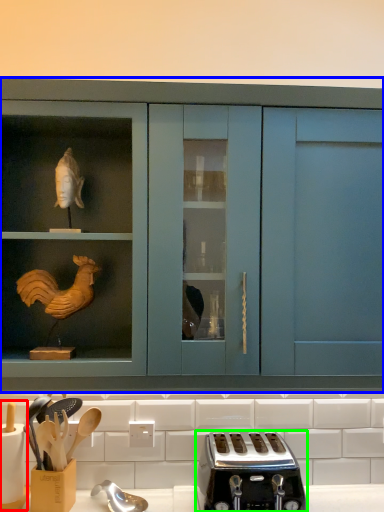
Question: Considering the real-world distances, which object is farthest from appliance (highlighted by a red box)? cabinetry (highlighted by a blue box) or toaster (highlighted by a green box)?

Choices:
 (A) cabinetry
 (B) toaster

Answer: (A)